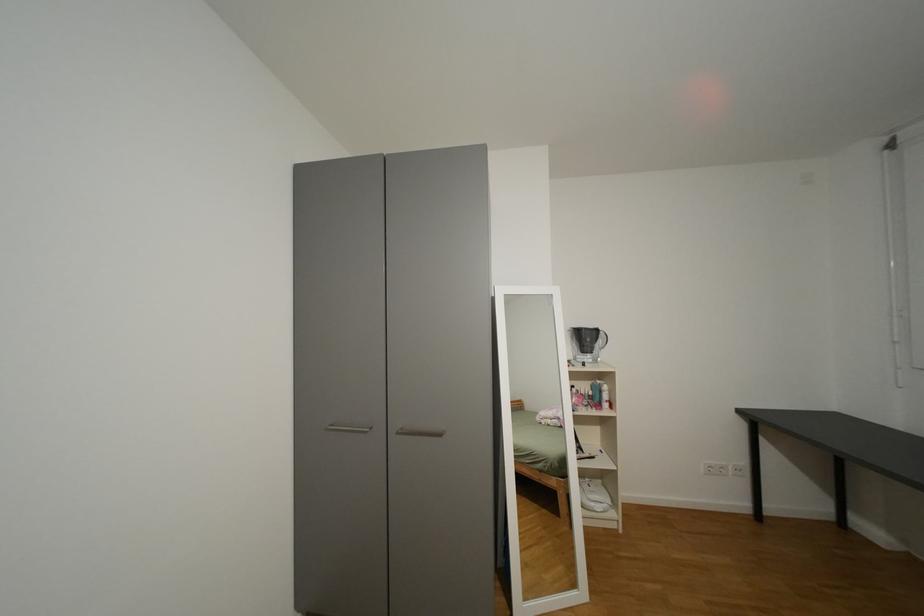
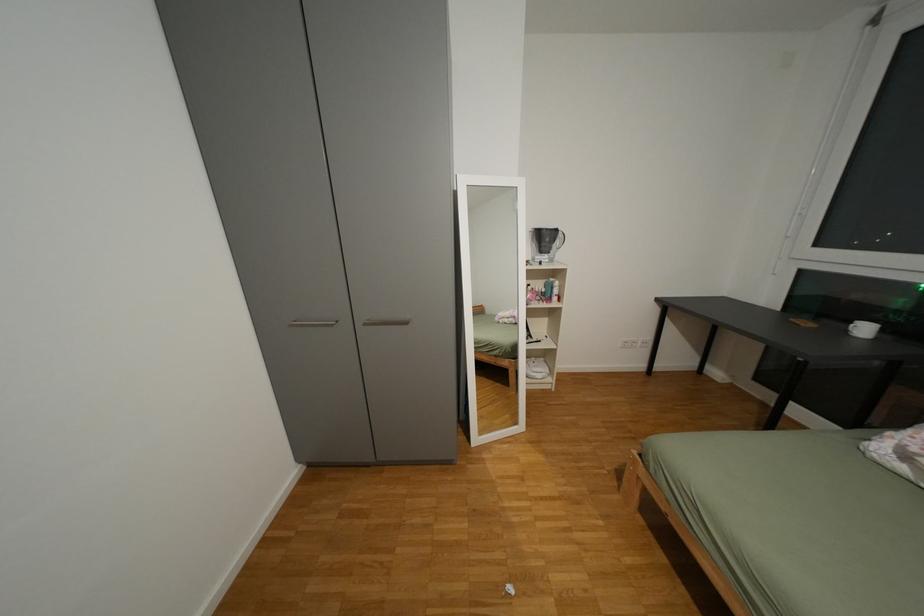
Which direction would the cameraman need to move to produce the second image?

The movement direction of the cameraman is right, backward.